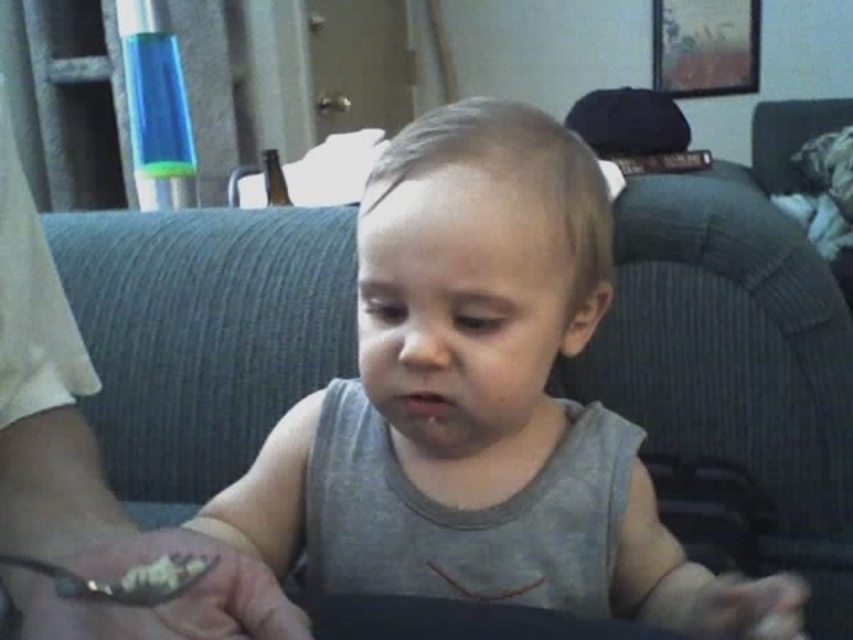
Question: Does gray cotton toddler at center appear over white creamy food at lower center?

Choices:
 (A) yes
 (B) no

Answer: (B)

Question: Observing the image, what is the correct spatial positioning of gray cotton toddler at center in reference to white creamy food at lower center?

Choices:
 (A) above
 (B) below

Answer: (B)

Question: Can you confirm if gray cotton toddler at center is positioned below white creamy food at lower center?

Choices:
 (A) yes
 (B) no

Answer: (A)